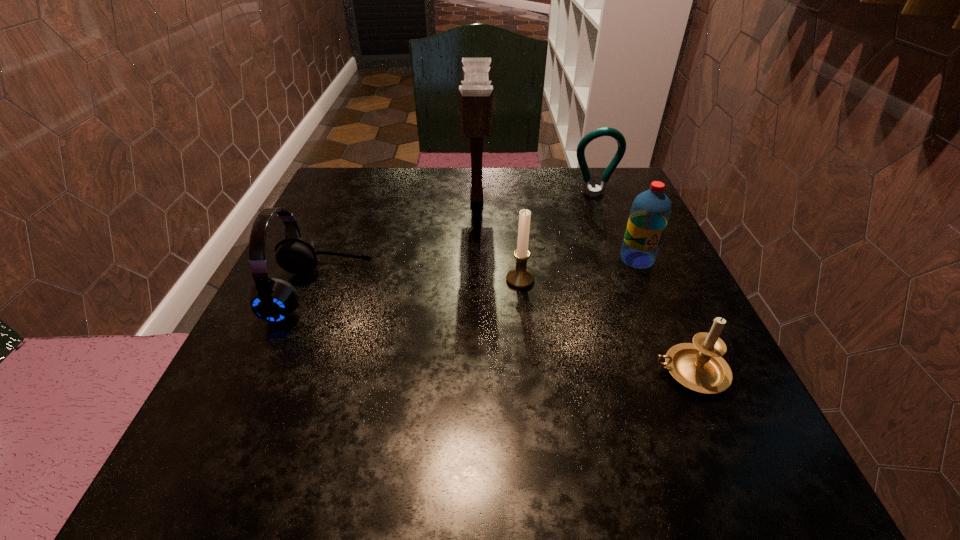
Find the location of a particular element. vacant space located at the jaws of the bottle opener is located at coordinates (617, 258).

The image size is (960, 540). What are the coordinates of `vacant space located on the ear cushions of the headset` in the screenshot? It's located at (510, 293).

Identify the location of free region located 0.370m on the front label of the water bottle. (720, 455).

Locate an element on the screen. The width and height of the screenshot is (960, 540). vacant space located on the back of the taller candle holder is located at coordinates (516, 246).

Identify the location of blank area located with a handle on the side of the right candle holder. (521, 372).

You are a GUI agent. You are given a task and a screenshot of the screen. Output one action in this format:
    pyautogui.click(x=<x>, y=<y>)
    Task: Click on the blank space located 0.250m with a handle on the side of the right candle holder
    This screenshot has width=960, height=540.
    Given the screenshot: What is the action you would take?
    pyautogui.click(x=488, y=372)

The height and width of the screenshot is (540, 960). I want to click on free region located 0.140m with a handle on the side of the right candle holder, so click(561, 372).

Image resolution: width=960 pixels, height=540 pixels. What are the coordinates of `mallet positioned at the far edge` in the screenshot? It's located at (475, 92).

At what (x,y) coordinates should I click in order to perform the action: click on bottle opener that is positioned at the far edge. Please return your answer as a coordinate pair (x, y). The height and width of the screenshot is (540, 960). Looking at the image, I should click on (605, 131).

Where is `object located in the left edge section of the desktop`? This screenshot has width=960, height=540. object located in the left edge section of the desktop is located at coordinates (273, 300).